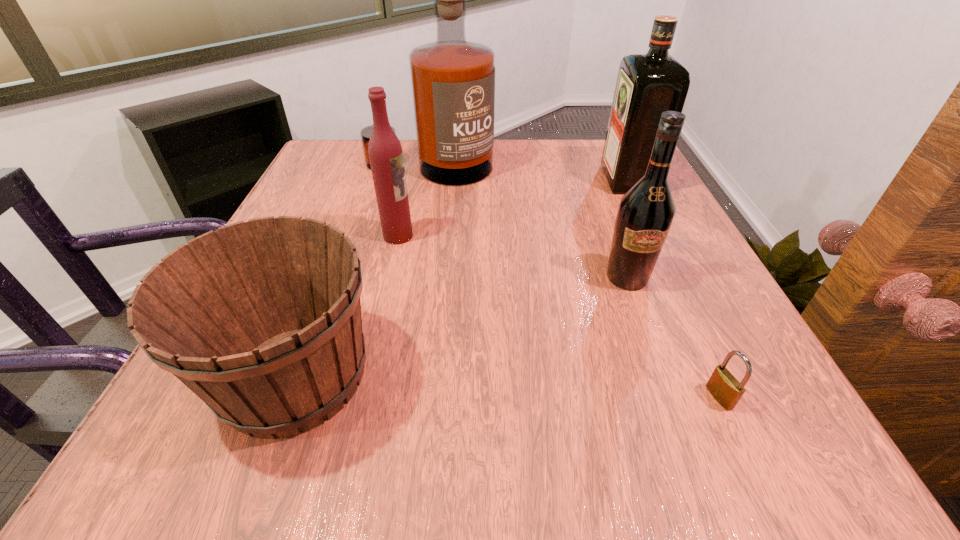
Locate an element on the screen. the tallest liquor is located at coordinates (453, 80).

At what (x,y) coordinates should I click in order to perform the action: click on the second shortest liquor. Please return your answer as a coordinate pair (x, y). The height and width of the screenshot is (540, 960). Looking at the image, I should click on (647, 85).

Locate an element on the screen. The width and height of the screenshot is (960, 540). wine bottle is located at coordinates (645, 214).

You are a GUI agent. You are given a task and a screenshot of the screen. Output one action in this format:
    pyautogui.click(x=<x>, y=<y>)
    Task: Click on the nearest liquor
    
    Given the screenshot: What is the action you would take?
    pyautogui.click(x=385, y=152)

Where is `the shortest liquor`? The image size is (960, 540). the shortest liquor is located at coordinates (385, 152).

At what (x,y) coordinates should I click in order to perform the action: click on the fifth tallest object. Please return your answer as a coordinate pair (x, y). Looking at the image, I should click on (261, 319).

This screenshot has height=540, width=960. I want to click on the shortest object, so click(x=724, y=387).

Locate an element on the screen. The image size is (960, 540). vacant space located 0.360m on the front label of the tallest liquor is located at coordinates (406, 297).

Locate an element on the screen. vacant space located 0.110m on the front label of the second tallest liquor is located at coordinates (559, 180).

Locate an element on the screen. The height and width of the screenshot is (540, 960). free location located on the front label of the second tallest liquor is located at coordinates (465, 180).